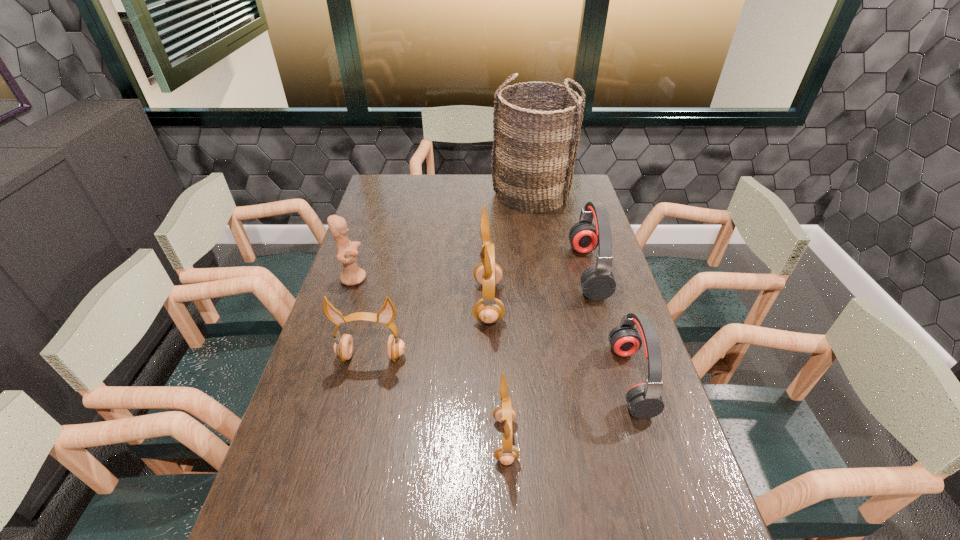
In the image, there is a desktop. Where is `vacant space at the far edge`? The image size is (960, 540). vacant space at the far edge is located at coordinates (444, 178).

The image size is (960, 540). What are the coordinates of `free spot at the left edge of the desktop` in the screenshot? It's located at (360, 252).

Where is `vacant region at the right edge of the desktop`? Image resolution: width=960 pixels, height=540 pixels. vacant region at the right edge of the desktop is located at coordinates (700, 517).

Locate an element on the screen. The width and height of the screenshot is (960, 540). vacant point at the far right corner is located at coordinates click(576, 191).

Where is `free space between the tallest earphone and the nearest brown earphone`? The image size is (960, 540). free space between the tallest earphone and the nearest brown earphone is located at coordinates tap(496, 371).

Find the location of a particular element. free area in between the sixth shortest object and the smaller red earphone is located at coordinates (560, 341).

I want to click on vacant area that lies between the farthest object and the figurine, so click(443, 237).

Image resolution: width=960 pixels, height=540 pixels. I want to click on free space that is in between the tallest object and the bigger red earphone, so click(560, 233).

Locate an element on the screen. free space between the smallest brown earphone and the smaller red earphone is located at coordinates pos(568,409).

Find the location of `vacant area between the farther red earphone and the biggest brown earphone`. vacant area between the farther red earphone and the biggest brown earphone is located at coordinates (539, 287).